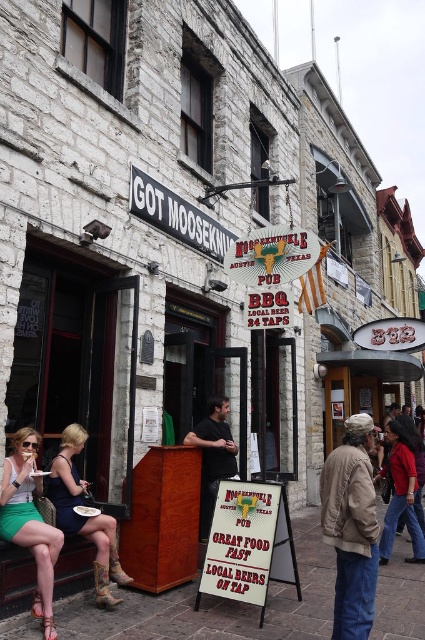
This screenshot has width=425, height=640. What do you see at coordinates (84, 516) in the screenshot?
I see `leather boots at lower left` at bounding box center [84, 516].

Between leather boots at lower left and blacksign at upper center, which one is positioned higher?

blacksign at upper center is above.

Which is in front, point (78, 452) or point (136, 204)?

Positioned in front is point (78, 452).

I want to click on leather boots at lower left, so click(84, 516).

Does point (238, 532) come closer to viewer compared to point (57, 513)?

No, it is not.

Image resolution: width=425 pixels, height=640 pixels. What are the coordinates of `white paper sign at center` in the screenshot? It's located at (240, 541).

Is point (223, 552) more distant than point (65, 477)?

No.

This screenshot has width=425, height=640. I want to click on white paper sign at center, so click(x=240, y=541).

Between point (47, 534) and point (172, 216), which one is positioned in front?

Positioned in front is point (47, 534).

Looking at this image, does matte green skirt at lower left appear on the right side of blacksign at upper center?

In fact, matte green skirt at lower left is to the left of blacksign at upper center.

This screenshot has width=425, height=640. What are the coordinates of `matte green skirt at lower left` in the screenshot? It's located at (30, 522).

Find the location of a particular element. Image resolution: width=425 pixels, height=640 pixels. matte green skirt at lower left is located at coordinates (30, 522).